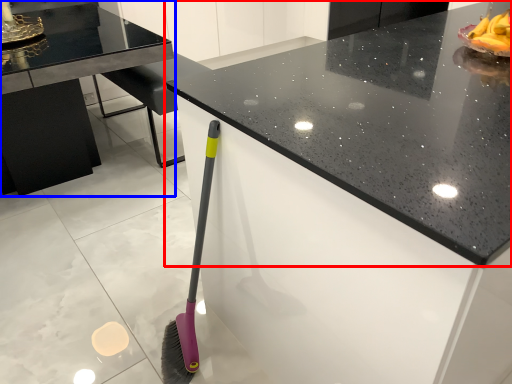
Question: Which point is further to the camera, countertop (highlighted by a red box) or table (highlighted by a blue box)?

Choices:
 (A) countertop
 (B) table

Answer: (B)